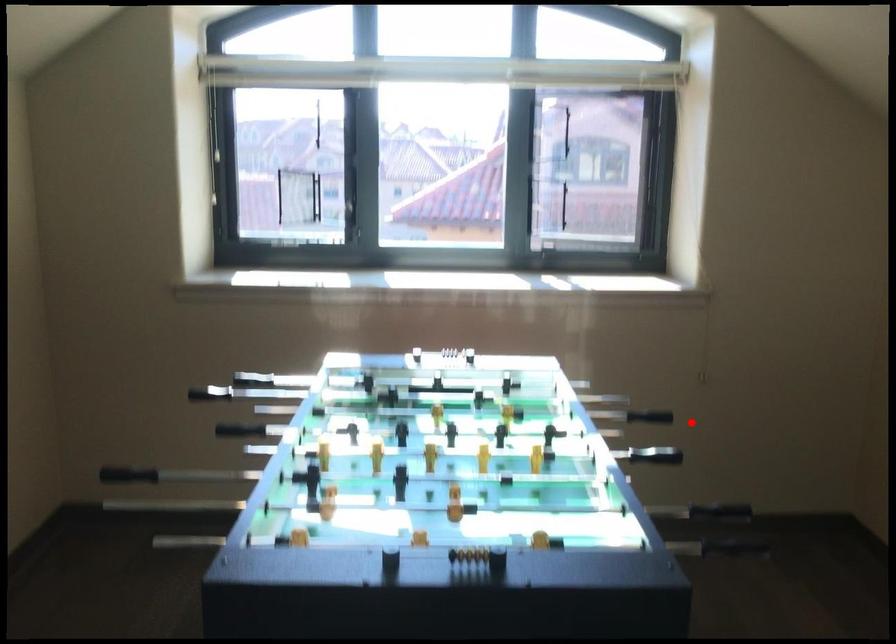
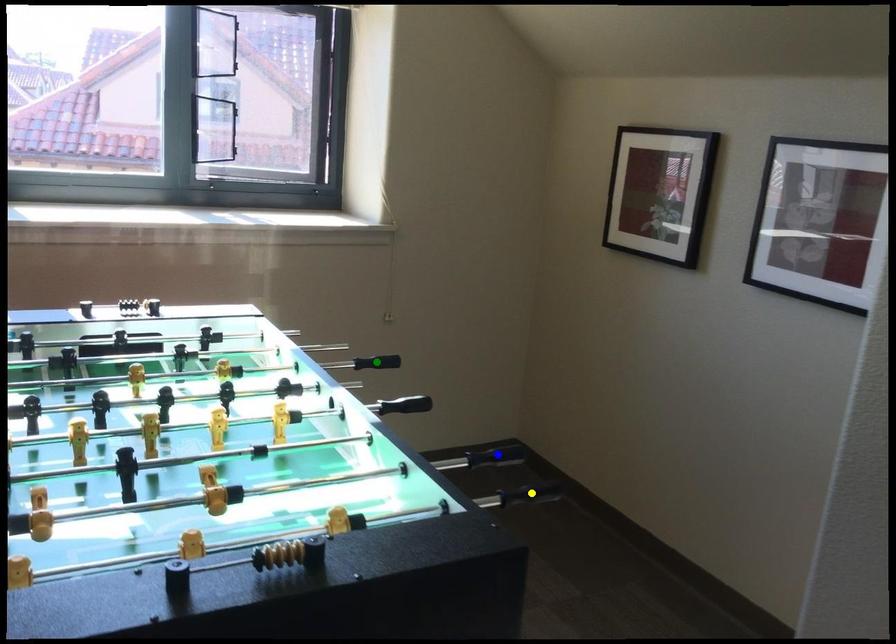
Question: I am providing you with two images of the same scene from different viewpoints. A red point is marked on the first image. You are given multiple points on the second image. Which point in image 2 represents the same 3d spot as the red point in image 1?

Choices:
 (A) blue point
 (B) yellow point
 (C) green point

Answer: (C)